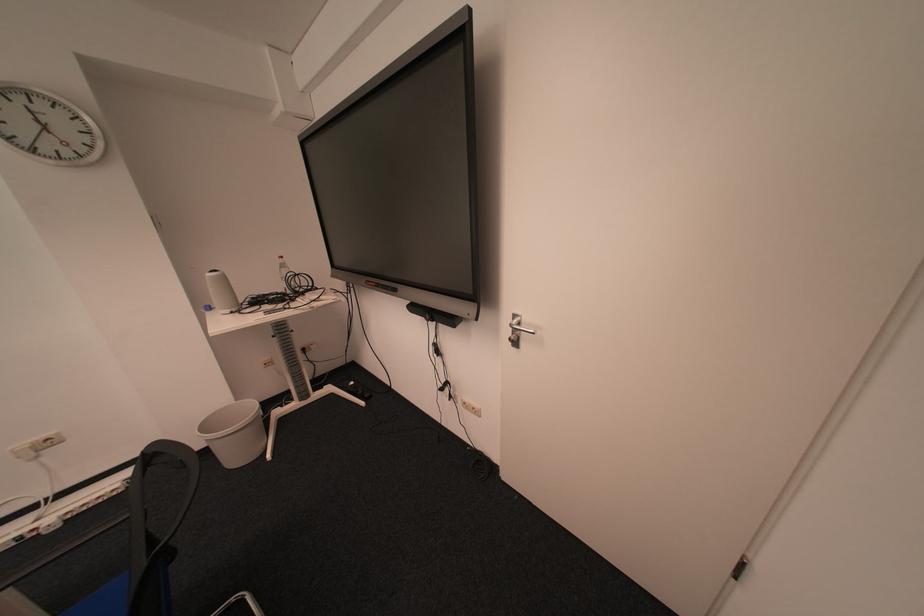
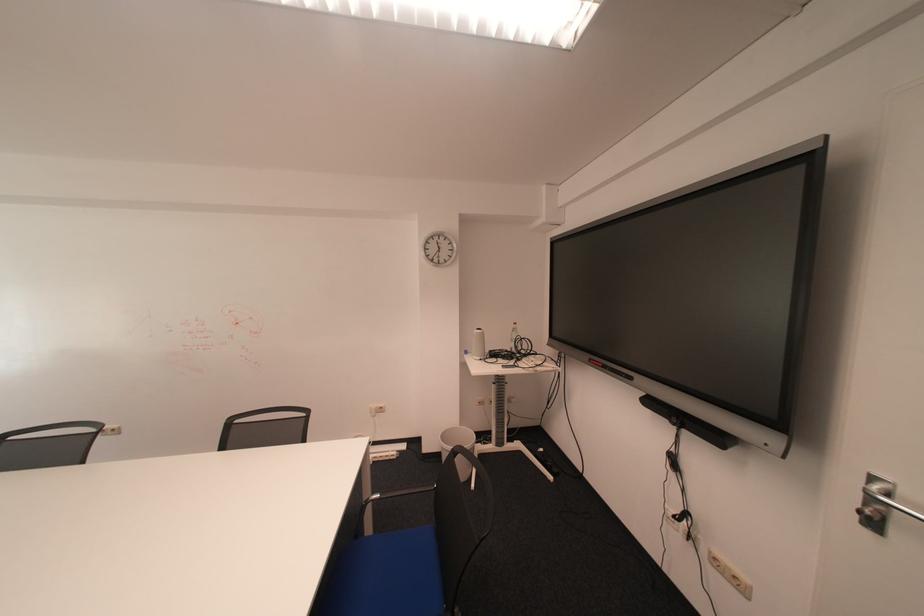
Find the pixel in the second image that matches the point at 525,330 in the first image.

(884, 501)